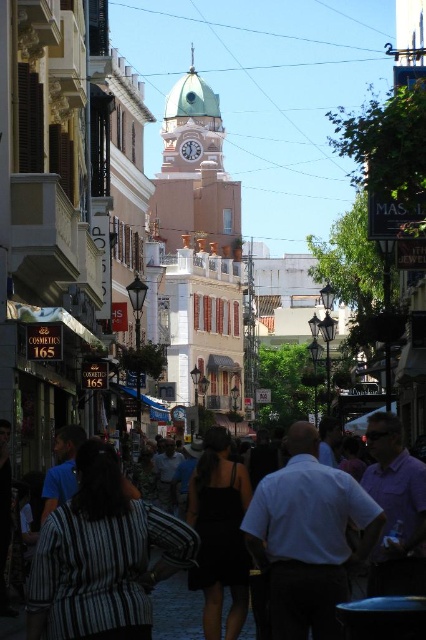
Can you confirm if light green dome at center is shorter than black cotton shirt at center?

In fact, light green dome at center may be taller than black cotton shirt at center.

Between point (230, 234) and point (2, 625), which one is positioned behind?

The point (230, 234) is more distant.

Identify the location of light green dome at center. The width and height of the screenshot is (426, 640). (195, 173).